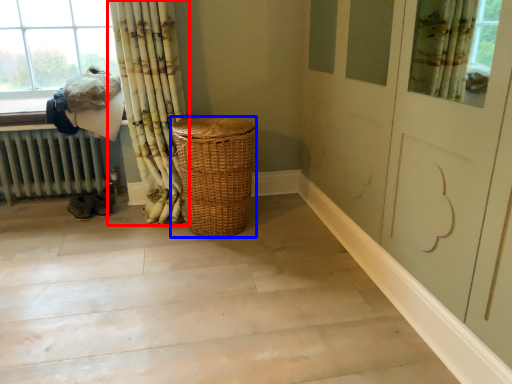
Question: Which point is further to the camera, curtain (highlighted by a red box) or basket (highlighted by a blue box)?

Choices:
 (A) curtain
 (B) basket

Answer: (B)